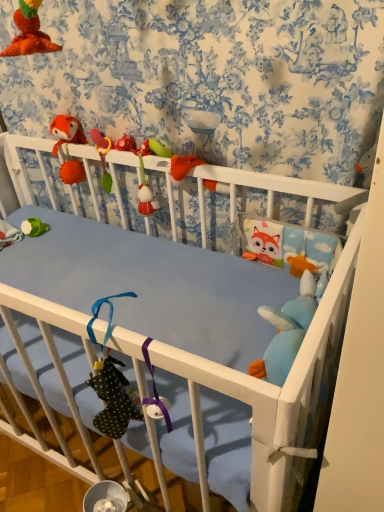
Question: Considering the relative sizes of soft plush toy at right, which is the first toy from front to back, and fluffy orange fox at upper left, the 1th toy when ordered from top to bottom, in the image provided, is soft plush toy at right, which is the first toy from front to back, taller than fluffy orange fox at upper left, the 1th toy when ordered from top to bottom,?

Choices:
 (A) yes
 (B) no

Answer: (B)

Question: Does soft plush toy at right, the 1th toy positioned from the bottom, have a larger size compared to fluffy orange fox at upper left, the 2th toy from the front?

Choices:
 (A) no
 (B) yes

Answer: (A)

Question: Considering the relative sizes of soft plush toy at right, placed as the second toy when sorted from back to front, and fluffy orange fox at upper left, the 1th toy when ordered from top to bottom, in the image provided, is soft plush toy at right, placed as the second toy when sorted from back to front, shorter than fluffy orange fox at upper left, the 1th toy when ordered from top to bottom,?

Choices:
 (A) yes
 (B) no

Answer: (A)

Question: Can you see soft plush toy at right, the 1th toy in the right-to-left sequence, touching fluffy orange fox at upper left, the first toy positioned from the back?

Choices:
 (A) no
 (B) yes

Answer: (A)

Question: Can you confirm if soft plush toy at right, which ranks as the 2th toy in top-to-bottom order, is positioned to the left of fluffy orange fox at upper left, which is counted as the second toy, starting from the right?

Choices:
 (A) no
 (B) yes

Answer: (A)

Question: From a real-world perspective, is soft plush toy at right, the 1th toy in the right-to-left sequence, positioned under fluffy orange fox at upper left, positioned as the 1th toy in left-to-right order, based on gravity?

Choices:
 (A) no
 (B) yes

Answer: (B)

Question: Is soft plush toy at right, which ranks as the 2th toy in top-to-bottom order, located within fluffy orange fox at upper left, the 2th toy from the front?

Choices:
 (A) yes
 (B) no

Answer: (B)

Question: Is fluffy orange fox at upper left, positioned as the 1th toy in left-to-right order, closer to camera compared to soft plush toy at right, which ranks as the 2th toy in top-to-bottom order?

Choices:
 (A) yes
 (B) no

Answer: (B)

Question: From a real-world perspective, is fluffy orange fox at upper left, the first toy positioned from the back, under soft plush toy at right, placed as the second toy when sorted from back to front?

Choices:
 (A) no
 (B) yes

Answer: (A)

Question: Can you confirm if fluffy orange fox at upper left, the 1th toy when ordered from top to bottom, is wider than soft plush toy at right, the second toy viewed from the left?

Choices:
 (A) yes
 (B) no

Answer: (B)

Question: Is fluffy orange fox at upper left, positioned as the 1th toy in left-to-right order, not near soft plush toy at right, which is the first toy from front to back?

Choices:
 (A) no
 (B) yes

Answer: (A)

Question: Is fluffy orange fox at upper left, positioned as the second toy in bottom-to-top order, to the right of soft plush toy at right, which is the first toy from front to back, from the viewer's perspective?

Choices:
 (A) no
 (B) yes

Answer: (A)

Question: From the image's perspective, relative to fluffy orange fox at upper left, the first toy positioned from the back, is soft plush toy at right, the 1th toy positioned from the bottom, above or below?

Choices:
 (A) below
 (B) above

Answer: (A)